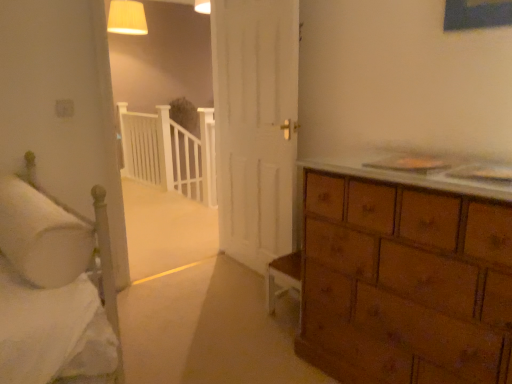
Describe the element at coordinates (42, 236) in the screenshot. This screenshot has width=512, height=384. I see `white soft pillow at left` at that location.

Where is `matte cream lampshade at upper center`? The width and height of the screenshot is (512, 384). matte cream lampshade at upper center is located at coordinates (127, 18).

From a real-world perspective, is matte cream lampshade at upper center above or below white wooden balustrade at center?

matte cream lampshade at upper center is situated higher than white wooden balustrade at center in the real world.

Measure the distance between matte cream lampshade at upper center and white wooden balustrade at center.

They are 1.76 meters apart.

Considering the positions of objects matte cream lampshade at upper center and white wooden balustrade at center in the image provided, who is more to the right, matte cream lampshade at upper center or white wooden balustrade at center?

From the viewer's perspective, white wooden balustrade at center appears more on the right side.

How different are the orientations of matte cream lampshade at upper center and white wooden balustrade at center in degrees?

2.35 degrees.

In order to click on balustrade that is under the white soft pillow at left (from a real-world perspective) in this screenshot , I will do `click(170, 152)`.

In terms of height, does white soft pillow at left look taller or shorter compared to white wooden balustrade at center?

Considering their sizes, white soft pillow at left has less height than white wooden balustrade at center.

Which object is positioned more to the left, white soft pillow at left or white wooden balustrade at center?

Positioned to the left is white soft pillow at left.

Is white wooden balustrade at center at the left side of white soft pillow at left?

No.

Based on their sizes in the image, would you say white wooden balustrade at center is bigger or smaller than white soft pillow at left?

In the image, white wooden balustrade at center appears to be larger than white soft pillow at left.

Is white soft pillow at left at the back of white wooden balustrade at center?

No, white wooden balustrade at center's orientation is not away from white soft pillow at left.

Does matte cream lampshade at upper center have a lesser height compared to white soft pillow at left?

In fact, matte cream lampshade at upper center may be taller than white soft pillow at left.

You are a GUI agent. You are given a task and a screenshot of the screen. Output one action in this format:
    pyautogui.click(x=<x>, y=<y>)
    Task: Click on the lighting lying above the white soft pillow at left (from the image's perspective)
    The width and height of the screenshot is (512, 384).
    Given the screenshot: What is the action you would take?
    pyautogui.click(x=127, y=18)

Which object is thinner, matte cream lampshade at upper center or white soft pillow at left?

matte cream lampshade at upper center.

Is matte cream lampshade at upper center placed right next to white soft pillow at left?

matte cream lampshade at upper center and white soft pillow at left are clearly separated.

Who is smaller, white wooden balustrade at center or matte cream lampshade at upper center?

matte cream lampshade at upper center.

From a real-world perspective, is white wooden balustrade at center on matte cream lampshade at upper center?

Incorrect, from a real-world perspective, white wooden balustrade at center is lower than matte cream lampshade at upper center.

Is white wooden balustrade at center to the left or to the right of matte cream lampshade at upper center in the image?

In the image, white wooden balustrade at center appears on the right side of matte cream lampshade at upper center.

There is a white wooden balustrade at center. Find the location of `lighting above it (from a real-world perspective)`. lighting above it (from a real-world perspective) is located at coordinates (127, 18).

Looking at the image, does white soft pillow at left seem bigger or smaller compared to matte cream lampshade at upper center?

Clearly, white soft pillow at left is smaller in size than matte cream lampshade at upper center.

Considering the positions of point (5, 181) and point (128, 19), is point (5, 181) closer or farther from the camera than point (128, 19)?

Clearly, point (5, 181) is closer to the camera than point (128, 19).

Can you tell me how much white soft pillow at left and matte cream lampshade at upper center differ in facing direction?

3.31 degrees.

From the picture: From a real-world perspective, is white soft pillow at left physically located above or below matte cream lampshade at upper center?

Clearly, from a real-world perspective, white soft pillow at left is below matte cream lampshade at upper center.

Find the location of a particular element. Image resolution: width=512 pixels, height=384 pixels. lighting above the white wooden balustrade at center (from a real-world perspective) is located at coordinates (127, 18).

The image size is (512, 384). In the image, there is a white soft pillow at left. Identify the location of balustrade above it (from the image's perspective). (170, 152).

Estimate the real-world distances between objects in this image. Which object is further from white wooden balustrade at center, matte cream lampshade at upper center or white soft pillow at left?

white soft pillow at left is positioned further to the anchor white wooden balustrade at center.

From the image, which object appears to be nearer to white soft pillow at left, white wooden balustrade at center or matte cream lampshade at upper center?

The object closer to white soft pillow at left is white wooden balustrade at center.

From the image, which object appears to be nearer to matte cream lampshade at upper center, white soft pillow at left or white wooden balustrade at center?

The object closer to matte cream lampshade at upper center is white wooden balustrade at center.

Based on their spatial positions, is white soft pillow at left or matte cream lampshade at upper center closer to white wooden balustrade at center?

matte cream lampshade at upper center lies closer to white wooden balustrade at center than the other object.

Considering their positions, is white wooden balustrade at center positioned further to matte cream lampshade at upper center than white soft pillow at left?

white soft pillow at left is further to matte cream lampshade at upper center.

Consider the image. From the image, which object appears to be nearer to white soft pillow at left, matte cream lampshade at upper center or white wooden balustrade at center?

white wooden balustrade at center is closer to white soft pillow at left.

Find the location of a particular element. lighting between white soft pillow at left and white wooden balustrade at center along the z-axis is located at coordinates (127, 18).